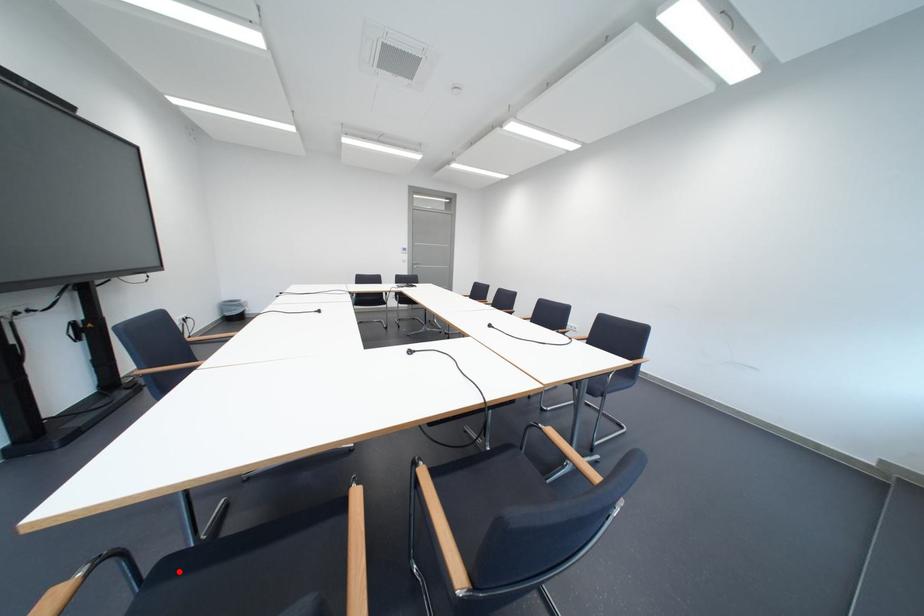
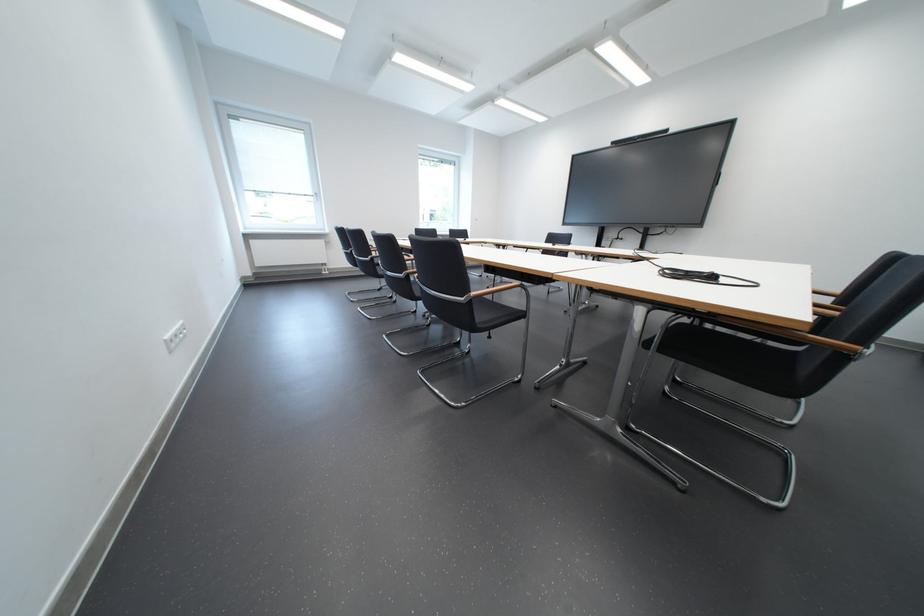
Question: I am providing you with two images of the same scene from different viewpoints. A red point is marked on the first image. Is the red point's position out of view in image 2?

Choices:
 (A) Yes
 (B) No

Answer: (A)